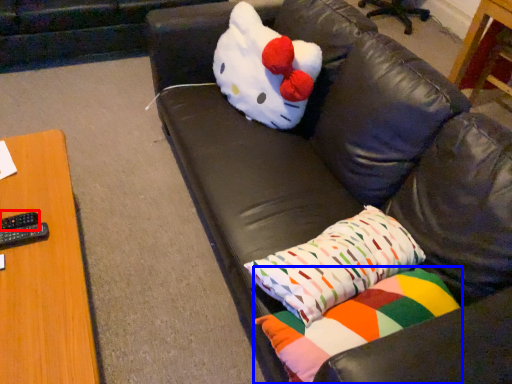
Question: Which point is further to the camera, remote (highlighted by a red box) or pillow (highlighted by a blue box)?

Choices:
 (A) remote
 (B) pillow

Answer: (A)